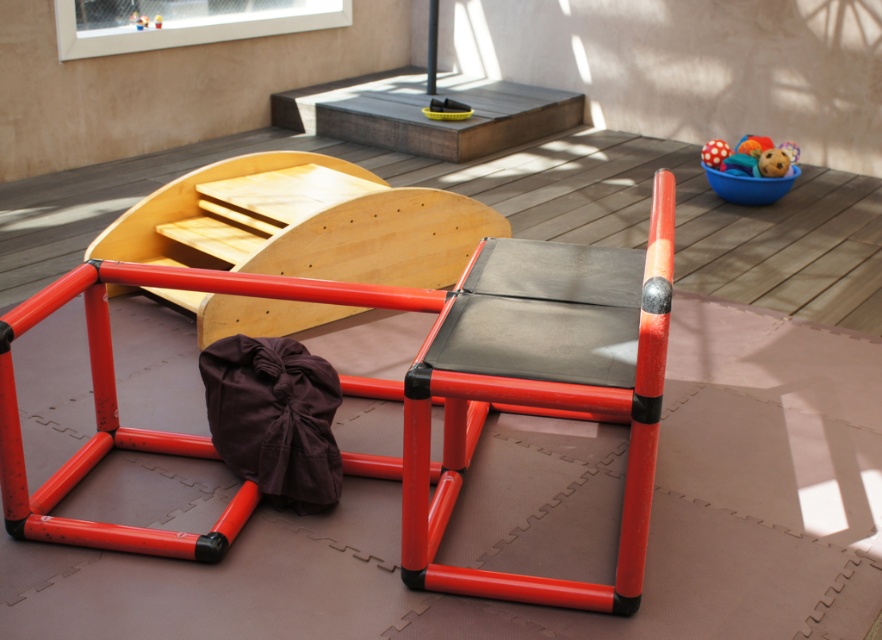
You are a child trying to reach the wooden deck where the slide is located. You are currently standing at point (626, 614). Which direction should you move to get closer to the wooden deck at point (753, 172)?

Since point (626, 614) is closer to the camera than point (753, 172), you should move towards the background to reach the wooden deck at point (753, 172).

Based on the photo, you are a child in the play area and want to reach the metallic red chair at center. There is a rubberized plastic ball at upper right above you. Can you safely step on the ball to reach the chair?

The metallic red chair at center is below the rubberized plastic ball at upper right, so stepping on the ball would not help you reach the chair since it is above the chair.